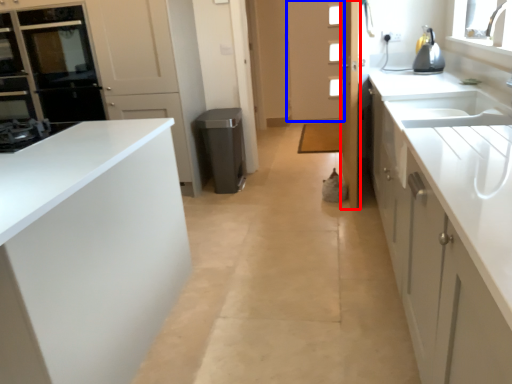
Question: Among these objects, which one is farthest to the camera, door (highlighted by a red box) or door (highlighted by a blue box)?

Choices:
 (A) door
 (B) door

Answer: (B)